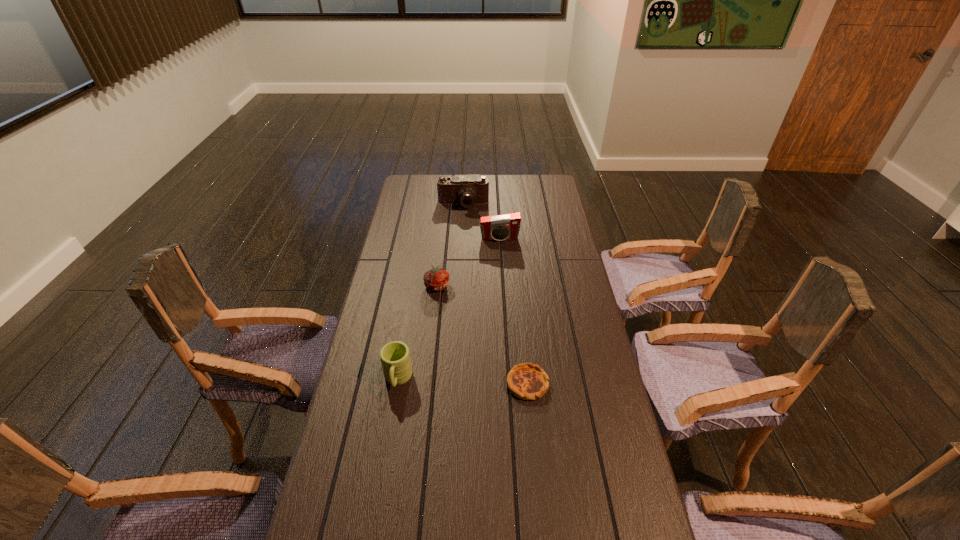
Where is `vacant space in between the quiche and the farther camera`? The height and width of the screenshot is (540, 960). vacant space in between the quiche and the farther camera is located at coordinates (x=495, y=294).

The width and height of the screenshot is (960, 540). What are the coordinates of `vacant space that is in between the third nearest object and the shortest object` in the screenshot? It's located at (482, 334).

Find the location of a particular element. free point between the farthest object and the tomato is located at coordinates (450, 245).

This screenshot has width=960, height=540. Find the location of `blank region between the nearer camera and the second shortest object`. blank region between the nearer camera and the second shortest object is located at coordinates (468, 262).

The height and width of the screenshot is (540, 960). I want to click on the third closest object relative to the third farthest object, so click(526, 381).

Identify the location of the second closest object to the tomato. This screenshot has height=540, width=960. (395, 358).

You are a GUI agent. You are given a task and a screenshot of the screen. Output one action in this format:
    pyautogui.click(x=<x>, y=<y>)
    Task: Click on the blank area in the image that satisfies the following two spatial constraints: 1. on the front-facing side of the nearer camera; 2. on the left side of the shortest object
    
    Given the screenshot: What is the action you would take?
    pyautogui.click(x=508, y=383)